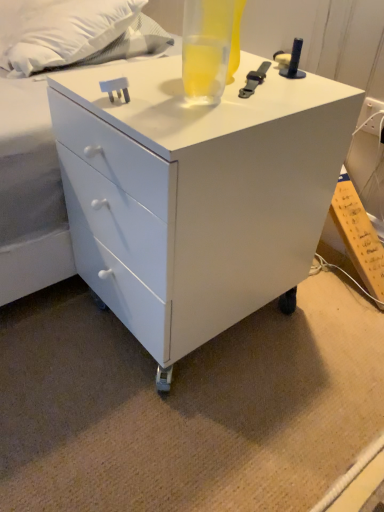
Image resolution: width=384 pixels, height=512 pixels. I want to click on free point in front of translucent glass beverage at top, so click(199, 113).